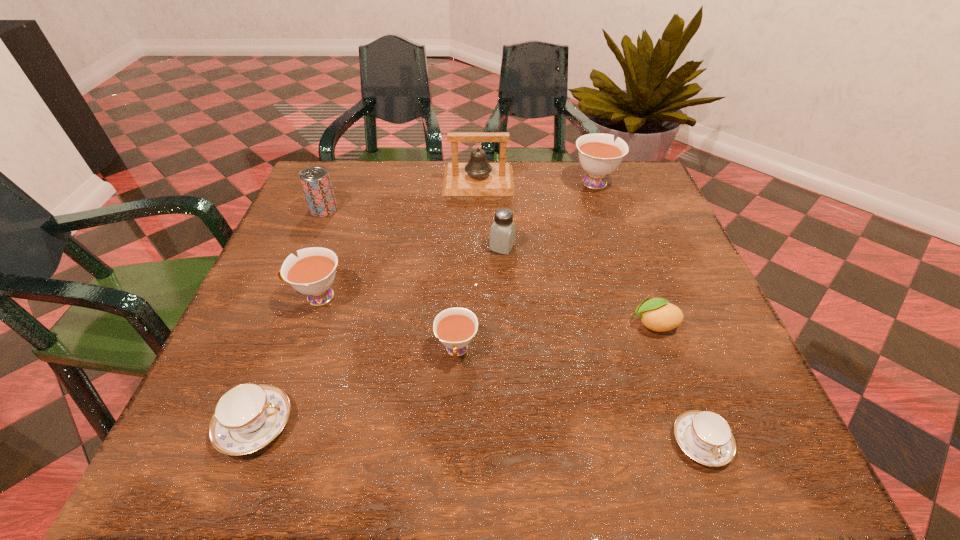
Find the location of a particular element. The height and width of the screenshot is (540, 960). object located in the near right corner section of the desktop is located at coordinates click(x=704, y=436).

Locate an element on the screen. This screenshot has height=540, width=960. free space at the far edge of the desktop is located at coordinates (420, 176).

I want to click on vacant area at the near edge, so click(346, 433).

In the image, there is a desktop. Where is `free space at the left edge`? The height and width of the screenshot is (540, 960). free space at the left edge is located at coordinates (292, 239).

In order to click on vacant space at the right edge of the desktop in this screenshot , I will do `click(703, 377)`.

In the image, there is a desktop. At what (x,y) coordinates should I click in order to perform the action: click on vacant space at the far left corner. Please return your answer as a coordinate pair (x, y). This screenshot has height=540, width=960. Looking at the image, I should click on (344, 163).

This screenshot has height=540, width=960. In order to click on free space between the left blue teacup and the second white teacup from right to left in this screenshot , I will do `click(356, 387)`.

Find the location of `free space between the second nearest white teacup and the left blue teacup`. free space between the second nearest white teacup and the left blue teacup is located at coordinates (286, 360).

Image resolution: width=960 pixels, height=540 pixels. What are the coordinates of `free space between the left blue teacup and the saltshaker` in the screenshot? It's located at (379, 335).

This screenshot has width=960, height=540. I want to click on free space between the second smallest white teacup and the fourth farthest object, so click(x=410, y=272).